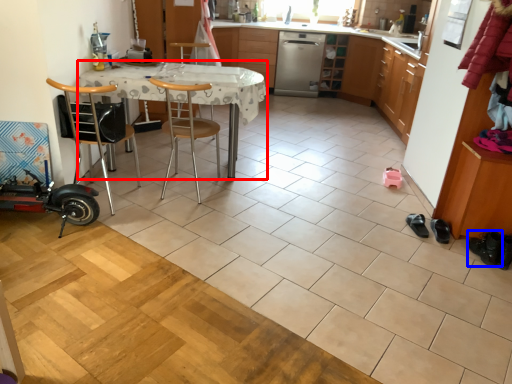
Question: Which of the following is the farthest to the observer, desk (highlighted by a red box) or footwear (highlighted by a blue box)?

Choices:
 (A) desk
 (B) footwear

Answer: (A)